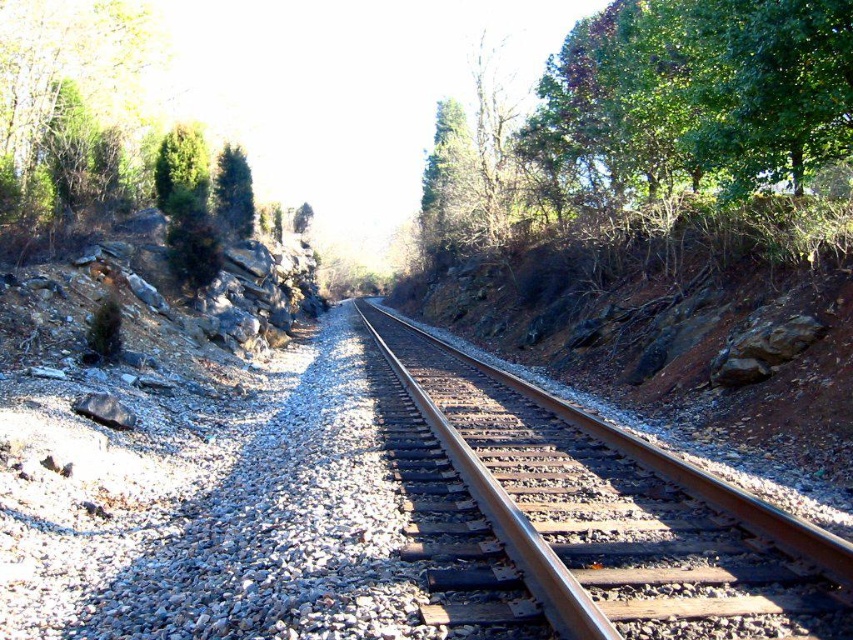
Question: Is green leafy tree at upper right smaller than green matte tree at upper left?

Choices:
 (A) no
 (B) yes

Answer: (A)

Question: Which object is closer to the camera taking this photo?

Choices:
 (A) metal train track at center
 (B) green matte tree at upper left
 (C) green leafy tree at upper right

Answer: (A)

Question: In this image, where is metal train track at center located relative to green matte tree at upper left?

Choices:
 (A) above
 (B) below

Answer: (B)

Question: Which point is closer to the camera?

Choices:
 (A) coord(608,205)
 (B) coord(227,198)

Answer: (A)

Question: Does green leafy tree at upper right appear over green matte tree at upper left?

Choices:
 (A) yes
 (B) no

Answer: (A)

Question: Estimate the real-world distances between objects in this image. Which object is farther from the green leafy tree at upper right?

Choices:
 (A) green matte tree at upper left
 (B) metal train track at center

Answer: (B)